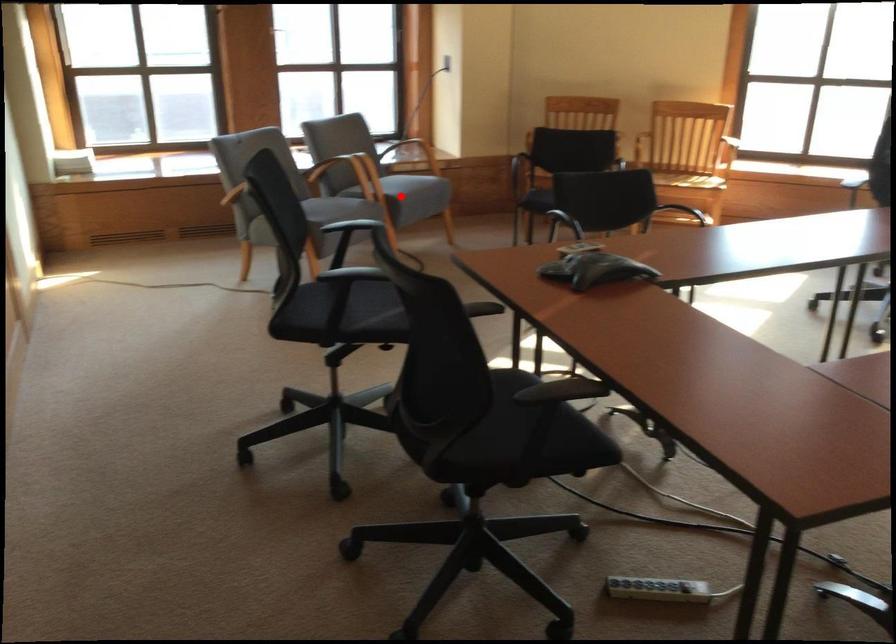
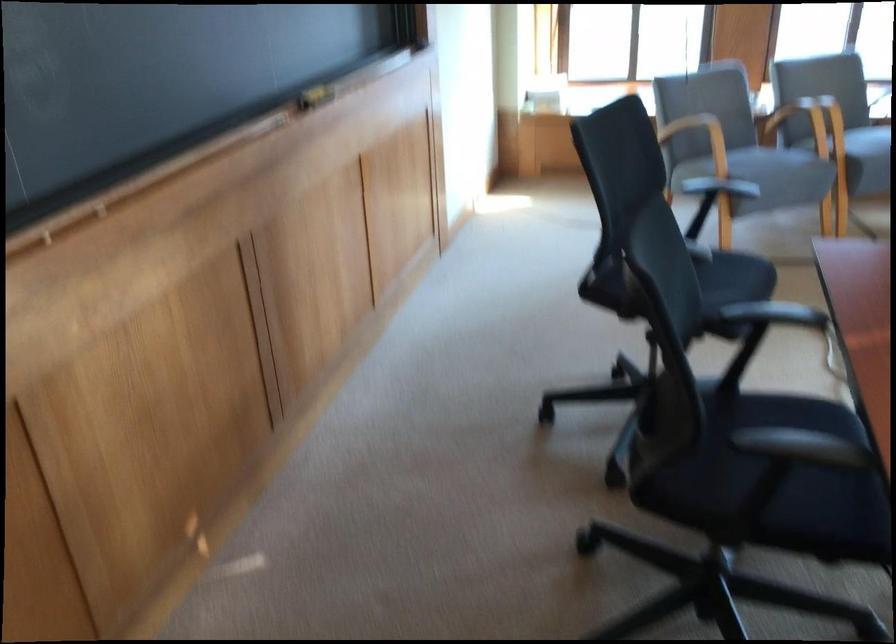
Where in the second image is the point corresponding to the highlighted location from the first image?

(859, 152)